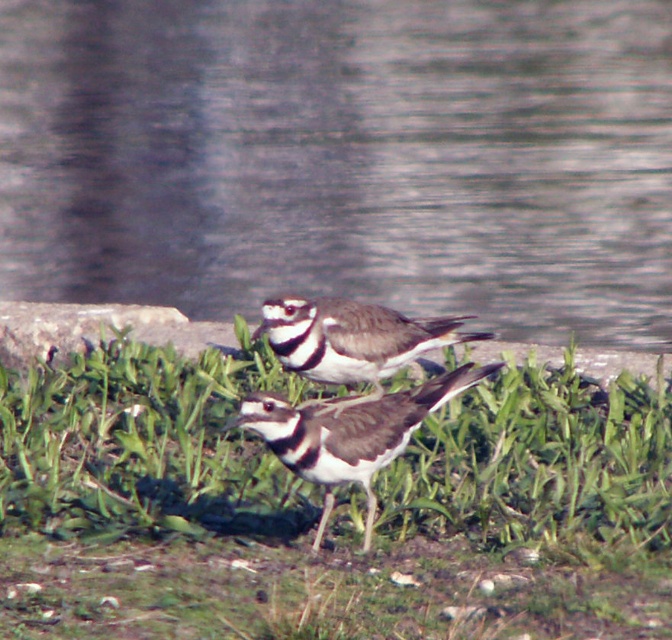
Between black and white speckled bird at center and speckled feathered bird at center, which one appears on the right side from the viewer's perspective?

speckled feathered bird at center is more to the right.

Can you confirm if black and white speckled bird at center is positioned below speckled feathered bird at center?

Yes.

Measure the distance between black and white speckled bird at center and camera.

black and white speckled bird at center is 3.70 meters away from camera.

The height and width of the screenshot is (640, 672). What are the coordinates of `black and white speckled bird at center` in the screenshot? It's located at (347, 433).

Based on the photo, is smooth water at center wider than speckled feathered bird at center?

Yes, smooth water at center is wider than speckled feathered bird at center.

Is point (267, 160) closer to camera compared to point (294, 323)?

No, it is behind (294, 323).

Find the location of a particular element. This screenshot has width=672, height=640. smooth water at center is located at coordinates (343, 157).

Between green grass at center and speckled feathered bird at center, which one is positioned higher?

speckled feathered bird at center

This screenshot has height=640, width=672. What do you see at coordinates (333, 513) in the screenshot?
I see `green grass at center` at bounding box center [333, 513].

Locate an element on the screen. The height and width of the screenshot is (640, 672). green grass at center is located at coordinates (333, 513).